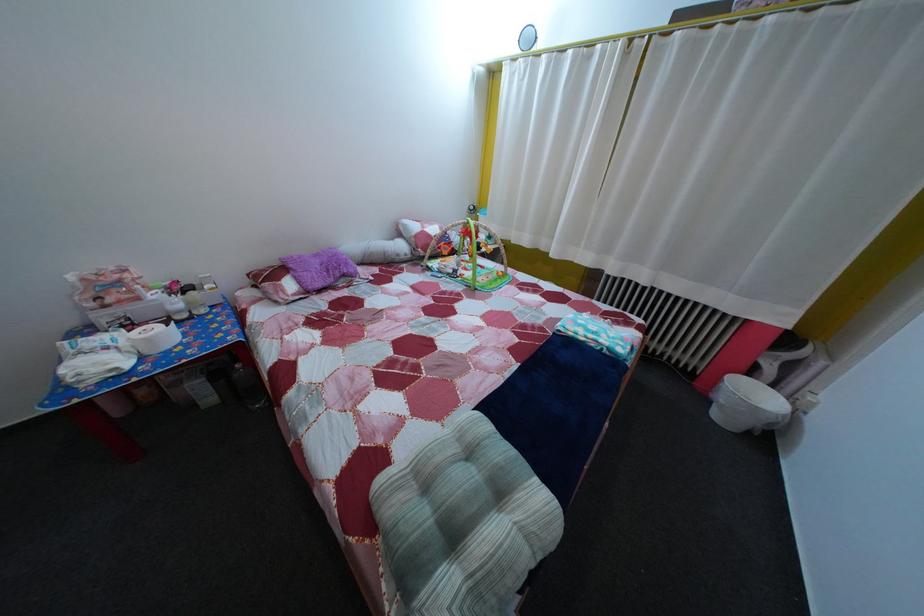
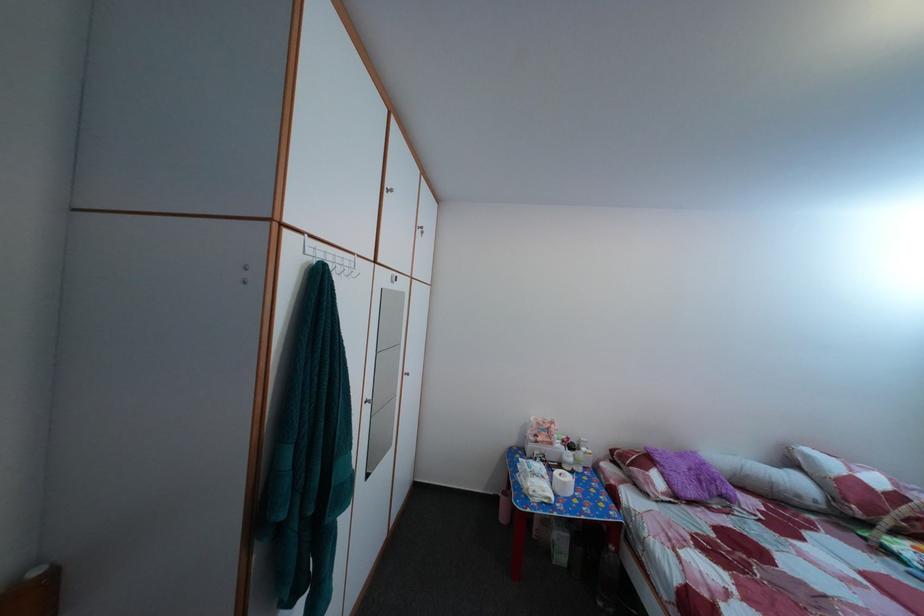
Where in the second image is the point corresponding to the point at 185,291 from the first image?

(578, 447)